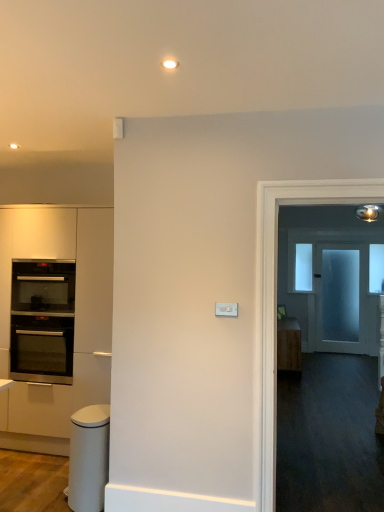
Question: Looking at their shapes, would you say transparent glass window at upper center, which is the 2th window from right to left, is wider or thinner than transparent glass window at upper right, acting as the second window starting from the left?

Choices:
 (A) thin
 (B) wide

Answer: (B)

Question: From a real-world perspective, relative to transparent glass window at upper right, arranged as the second window when viewed from the back, is transparent glass window at upper center, which is the 2th window from right to left, vertically above or below?

Choices:
 (A) below
 (B) above

Answer: (A)

Question: Estimate the real-world distances between objects in this image. Which object is closer to the frosted glass door at right?

Choices:
 (A) wooden cabinet at right, marked as the 1th cabinetry in a back-to-front arrangement
 (B) black glass oven at left, the second oven in the bottom-to-top sequence
 (C) stainless steel oven at left, positioned as the 2th oven in top-to-bottom order
 (D) white glossy trash can at lower left
 (E) transparent glass window at upper center, which is the 2th window from right to left

Answer: (E)

Question: Estimate the real-world distances between objects in this image. Which object is farther from the stainless steel oven at left, positioned as the 2th oven in top-to-bottom order?

Choices:
 (A) transparent glass window at upper center, placed as the 1th window when sorted from back to front
 (B) white glossy trash can at lower left
 (C) black glass oven at left, the 1th oven positioned from the top
 (D) frosted glass door at right
 (E) wooden cabinet at right, the 2th cabinetry positioned from the front

Answer: (D)